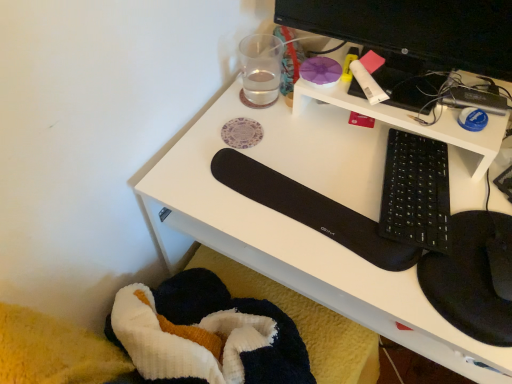
Where is `blank area to the left of transparent glass at upper center, the 1th stationery from the back`? The image size is (512, 384). blank area to the left of transparent glass at upper center, the 1th stationery from the back is located at coordinates (214, 108).